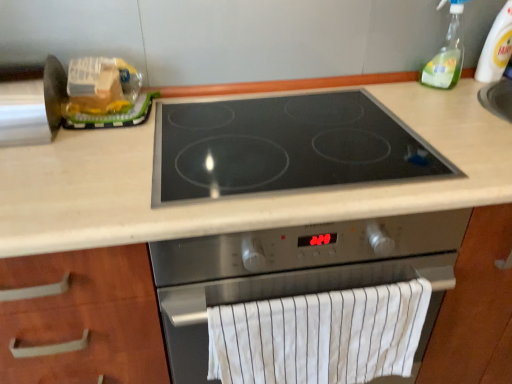
Where is `free space that is in between clear plastic bottle at upper right and clear plastic bottle at upper right`? The width and height of the screenshot is (512, 384). free space that is in between clear plastic bottle at upper right and clear plastic bottle at upper right is located at coordinates pos(470,84).